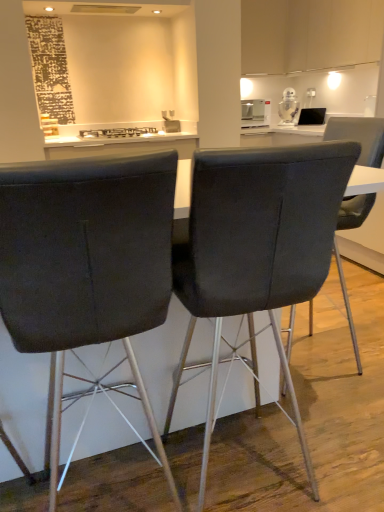
This screenshot has width=384, height=512. Find the location of `free point below velvet dark gray chair at center, placed as the third chair when sorted from left to right (from a real-world perspective)`. free point below velvet dark gray chair at center, placed as the third chair when sorted from left to right (from a real-world perspective) is located at coordinates (334, 349).